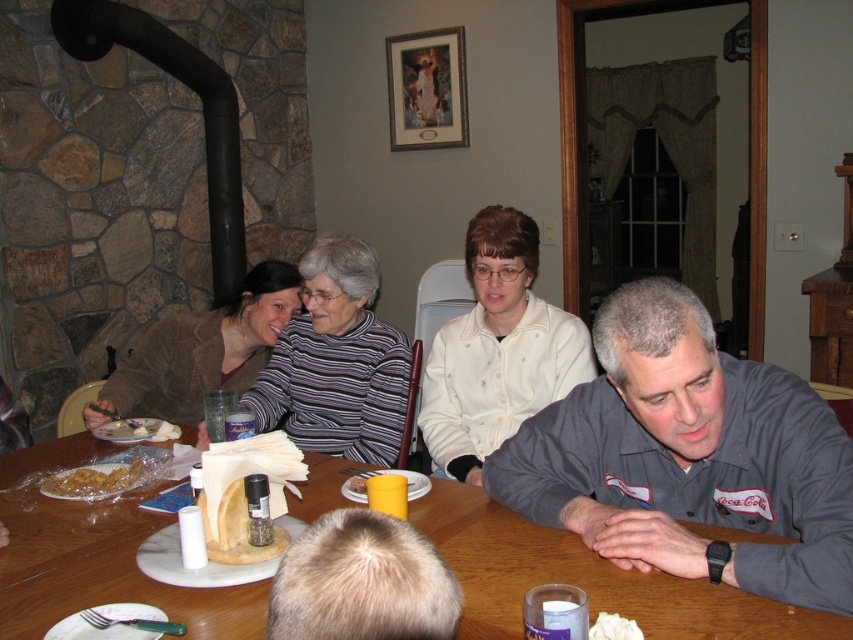
You are a waiter in a cozy home setting. You need to place a drink on the table between the gray fabric shirt at lower right and the golden crispy chicken at lower left. The drink requires 1 foot of space. Is there enough space?

The distance between the gray fabric shirt at lower right and the golden crispy chicken at lower left is 3.63 feet, which is more than the required 1 foot of space. Therefore, there is enough space to place the drink between them.

You are a food delivery person who needs to place a golden crispy chicken at lower left and a white fluffy bread at lower center on a 4 feet long tray. Can you fit both items on the tray without overlapping?

The golden crispy chicken at lower left and white fluffy bread at lower center are 3.94 feet apart from each other, so yes, they can be placed on a 4 feet long tray without overlapping since the distance between them is less than the tray length.

Consider the image. You are a photographer taking a picture of the scene. You want to focus on the golden crispy chicken at lower left without the gray fabric shirt at lower right blocking it. What should you do?

The gray fabric shirt at lower right is in front of the golden crispy chicken at lower left, so you should move the gray fabric shirt at lower right out of the frame or adjust your angle to avoid it blocking the view of the golden crispy chicken at lower left.